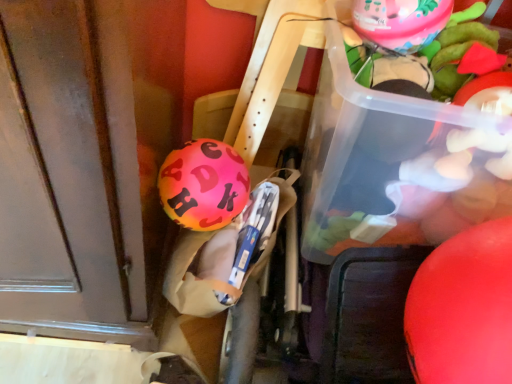
Question: Is translucent plastic container at upper right positioned in front of shiny pink balloon at center, acting as the third balloon starting from the right?

Choices:
 (A) yes
 (B) no

Answer: (A)

Question: Can you confirm if translucent plastic container at upper right is shorter than shiny pink balloon at center, acting as the third balloon starting from the right?

Choices:
 (A) no
 (B) yes

Answer: (A)

Question: Is translucent plastic container at upper right to the left of shiny pink balloon at center, arranged as the first balloon when viewed from the left, from the viewer's perspective?

Choices:
 (A) yes
 (B) no

Answer: (B)

Question: Can you confirm if translucent plastic container at upper right is thinner than shiny pink balloon at center, which is the second balloon in top-to-bottom order?

Choices:
 (A) no
 (B) yes

Answer: (A)

Question: Is translucent plastic container at upper right positioned far away from shiny pink balloon at center, arranged as the first balloon when viewed from the left?

Choices:
 (A) no
 (B) yes

Answer: (A)

Question: Is translucent plastic container at upper right taller than shiny pink balloon at center, which is the second balloon in top-to-bottom order?

Choices:
 (A) yes
 (B) no

Answer: (A)

Question: Does rubber matte balloon at right, the first balloon in the right-to-left sequence, have a larger size compared to translucent plastic container at upper right?

Choices:
 (A) no
 (B) yes

Answer: (A)

Question: Does rubber matte balloon at right, which ranks as the third balloon in left-to-right order, have a lesser height compared to translucent plastic container at upper right?

Choices:
 (A) no
 (B) yes

Answer: (B)

Question: Is translucent plastic container at upper right inside rubber matte balloon at right, the first balloon from the bottom?

Choices:
 (A) yes
 (B) no

Answer: (B)

Question: Considering the relative sizes of rubber matte balloon at right, which is the 3th balloon in top-to-bottom order, and translucent plastic container at upper right in the image provided, is rubber matte balloon at right, which is the 3th balloon in top-to-bottom order, wider than translucent plastic container at upper right?

Choices:
 (A) yes
 (B) no

Answer: (B)

Question: Is rubber matte balloon at right, which ranks as the third balloon in left-to-right order, at the left side of translucent plastic container at upper right?

Choices:
 (A) no
 (B) yes

Answer: (A)

Question: Is rubber matte balloon at right, which is the 3th balloon in top-to-bottom order, further to the viewer compared to translucent plastic container at upper right?

Choices:
 (A) yes
 (B) no

Answer: (B)

Question: Is pink rubber balloon at upper right, marked as the first balloon in a top-to-bottom arrangement, positioned in front of rubber matte balloon at right, which ranks as the third balloon in left-to-right order?

Choices:
 (A) yes
 (B) no

Answer: (B)